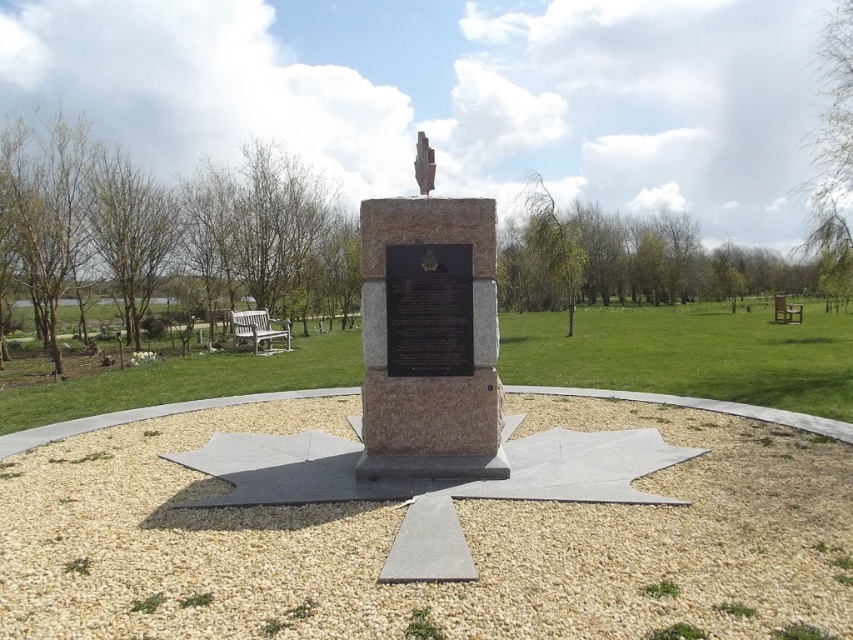
You are a visitor at the memorial and want to sit on the bench closest to the monument. Which bench should you choose between the white wooden bench at lower left and the wooden park bench at right?

The white wooden bench at lower left is in front of the wooden park bench at right, so the white wooden bench at lower left is closer to the monument. You should choose the white wooden bench at lower left.

You are standing at the entrance of the park and see the granite stone monument at center and the white wooden bench at lower left. Which object is taller?

The granite stone monument at center is taller than the white wooden bench at lower left.